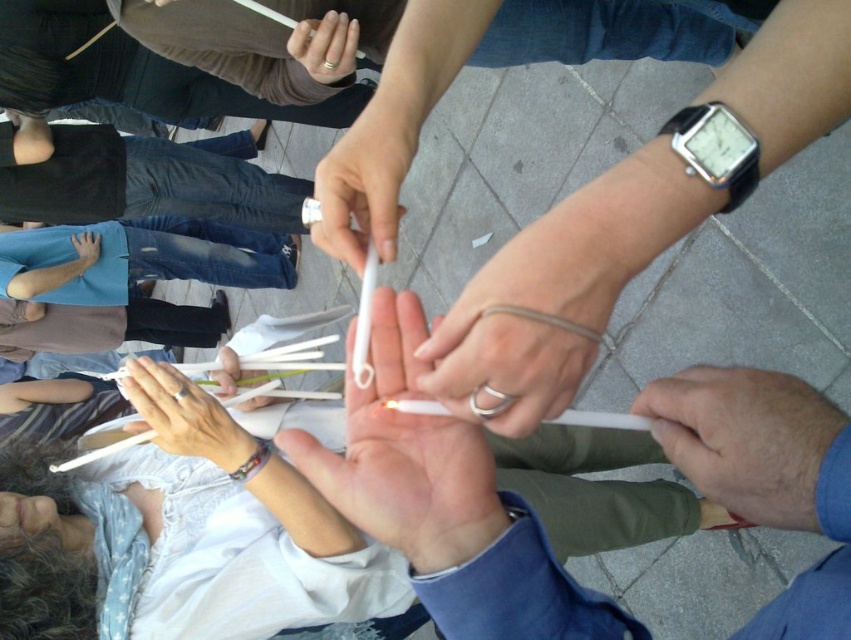
You are a photographer standing at the camera position. You want to take a photo of the scene where the point at point (x=544, y=326) is in focus. If your camera has a depth of field that can sharply focus objects within 30 centimeters from the point you focus on, where should you set the focus to ensure both the candles and the background participants are in focus?

To ensure both the candles and the background participants are in focus, you should set the focus point at the point (x=544, y=326) since it is 40.95 centimeters away from the camera. With a depth of field covering 30 centimeters from this point, the candles closer than this distance and the background beyond it would fall within the acceptable focus range.

In the scene shown: You are a photographer trying to capture the exact height of both the silver metallic ring at center and the white matte cigarette at center. Based on the scene, which object would require you to focus on a closer plane to capture its detail?

The silver metallic ring at center is shorter than the white matte cigarette at center, so to capture its detail, you would need to focus on a closer plane since it is smaller in height.